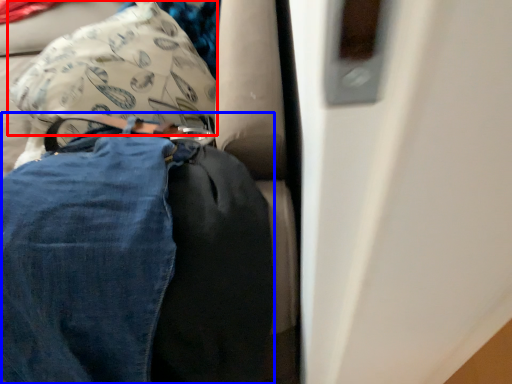
Question: Which point is closer to the camera, pillow (highlighted by a red box) or trousers (highlighted by a blue box)?

Choices:
 (A) pillow
 (B) trousers

Answer: (B)